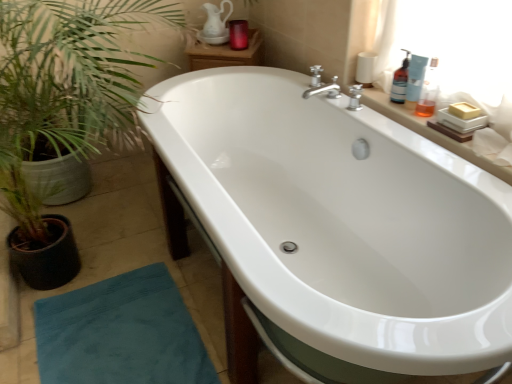
Question: Considering the relative sizes of translucent plastic bottle at upper right, placed as the 3th toiletry when sorted from left to right, and blue plastic bottle at upper right, arranged as the fourth toiletry when viewed from the left, in the image provided, is translucent plastic bottle at upper right, placed as the 3th toiletry when sorted from left to right, taller than blue plastic bottle at upper right, arranged as the fourth toiletry when viewed from the left,?

Choices:
 (A) no
 (B) yes

Answer: (A)

Question: From the image's perspective, is translucent plastic bottle at upper right, which is counted as the 2th toiletry, starting from the right, above blue plastic bottle at upper right, arranged as the fourth toiletry when viewed from the left?

Choices:
 (A) yes
 (B) no

Answer: (A)

Question: Considering the relative sizes of translucent plastic bottle at upper right, placed as the 3th toiletry when sorted from left to right, and blue plastic bottle at upper right, arranged as the fourth toiletry when viewed from the left, in the image provided, is translucent plastic bottle at upper right, placed as the 3th toiletry when sorted from left to right, shorter than blue plastic bottle at upper right, arranged as the fourth toiletry when viewed from the left,?

Choices:
 (A) yes
 (B) no

Answer: (A)

Question: From the image's perspective, is translucent plastic bottle at upper right, the 2th toiletry from the front, below blue plastic bottle at upper right, arranged as the fourth toiletry when viewed from the left?

Choices:
 (A) yes
 (B) no

Answer: (B)

Question: Is translucent plastic bottle at upper right, placed as the 3th toiletry when sorted from left to right, positioned behind blue plastic bottle at upper right, arranged as the first toiletry when viewed from the right?

Choices:
 (A) yes
 (B) no

Answer: (A)

Question: Is point (286, 342) closer or farther from the camera than point (393, 76)?

Choices:
 (A) farther
 (B) closer

Answer: (B)

Question: Is white glossy bathtub at center inside or outside of translucent plastic bottle at upper right, which appears as the third toiletry when viewed from the right?

Choices:
 (A) outside
 (B) inside

Answer: (A)

Question: From a real-world perspective, relative to translucent plastic bottle at upper right, the third toiletry from the front, is white glossy bathtub at center vertically above or below?

Choices:
 (A) above
 (B) below

Answer: (B)

Question: In terms of size, does white glossy bathtub at center appear bigger or smaller than translucent plastic bottle at upper right, the third toiletry from the front?

Choices:
 (A) big
 (B) small

Answer: (A)

Question: Which is correct: blue plastic bottle at upper right, the 4th toiletry from the back, is inside teal fabric doormat at lower left, or outside of it?

Choices:
 (A) outside
 (B) inside

Answer: (A)

Question: Is blue plastic bottle at upper right, the 4th toiletry from the back, in front of or behind teal fabric doormat at lower left in the image?

Choices:
 (A) front
 (B) behind

Answer: (B)

Question: From a real-world perspective, is blue plastic bottle at upper right, arranged as the fourth toiletry when viewed from the left, physically located above or below teal fabric doormat at lower left?

Choices:
 (A) above
 (B) below

Answer: (A)

Question: Looking at their shapes, would you say blue plastic bottle at upper right, which is counted as the 1th toiletry, starting from the front, is wider or thinner than teal fabric doormat at lower left?

Choices:
 (A) wide
 (B) thin

Answer: (B)

Question: Considering the relative positions of translucent plastic bottle at upper right, the 3th toiletry from the back, and matte glass candle at upper center, the first toiletry in the back-to-front sequence, in the image provided, is translucent plastic bottle at upper right, the 3th toiletry from the back, to the left or to the right of matte glass candle at upper center, the first toiletry in the back-to-front sequence,?

Choices:
 (A) right
 (B) left

Answer: (A)

Question: In terms of height, does translucent plastic bottle at upper right, placed as the 3th toiletry when sorted from left to right, look taller or shorter compared to matte glass candle at upper center, the first toiletry in the back-to-front sequence?

Choices:
 (A) tall
 (B) short

Answer: (A)